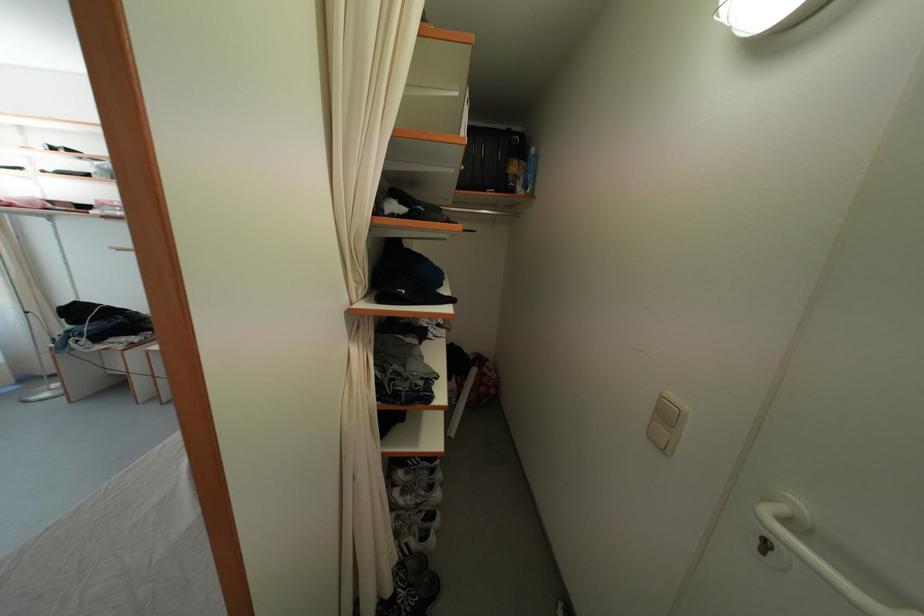
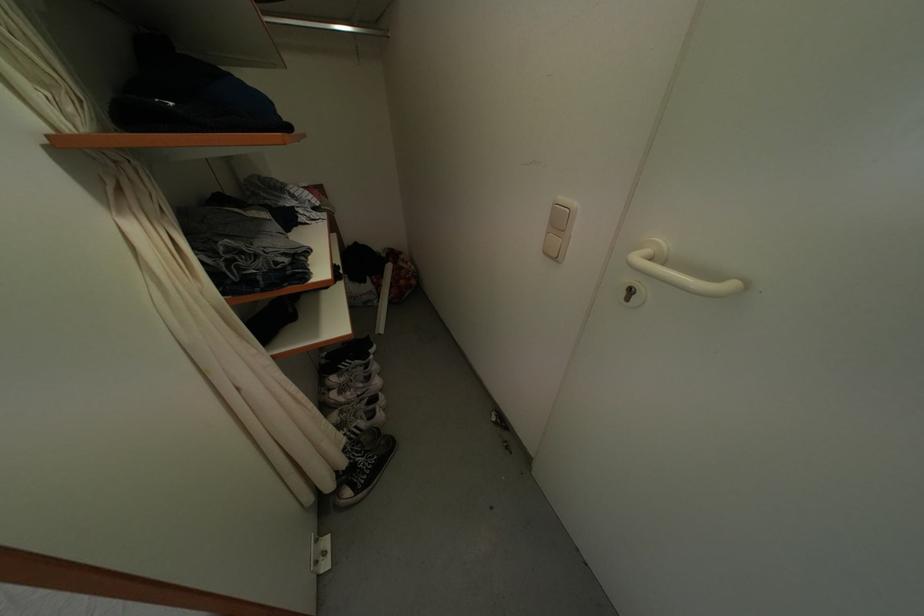
Locate, in the second image, the point that corresponds to (762,546) in the first image.

(630, 299)